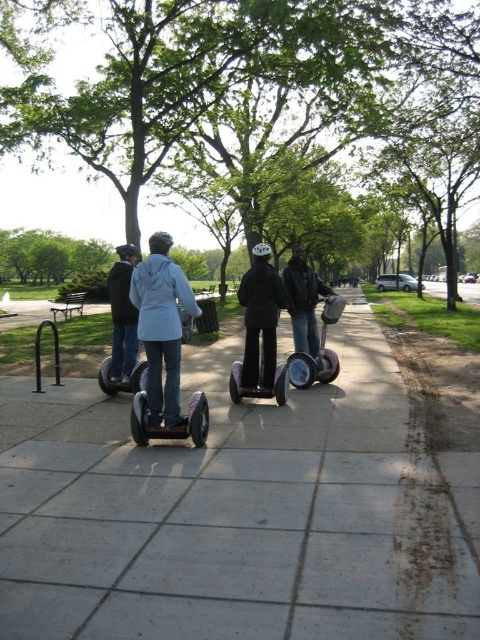
Question: Does gray concrete sidewalk at center appear on the left side of black matte helmet at center?

Choices:
 (A) no
 (B) yes

Answer: (B)

Question: Does gray concrete sidewalk at center lie in front of black matte helmet at center?

Choices:
 (A) yes
 (B) no

Answer: (A)

Question: Is light blue fabric jacket at center further to the viewer compared to shiny black scooter at center?

Choices:
 (A) yes
 (B) no

Answer: (B)

Question: Which of these objects is positioned closest to the light blue denim jacket at center?

Choices:
 (A) shiny black scooter at center
 (B) gray concrete sidewalk at center
 (C) black matte helmet at center

Answer: (A)

Question: Which point is closer to the camera taking this photo?

Choices:
 (A) (298, 244)
 (B) (135, 333)

Answer: (B)

Question: Which point appears farthest from the camera in this image?

Choices:
 (A) (314, 332)
 (B) (299, 362)

Answer: (A)